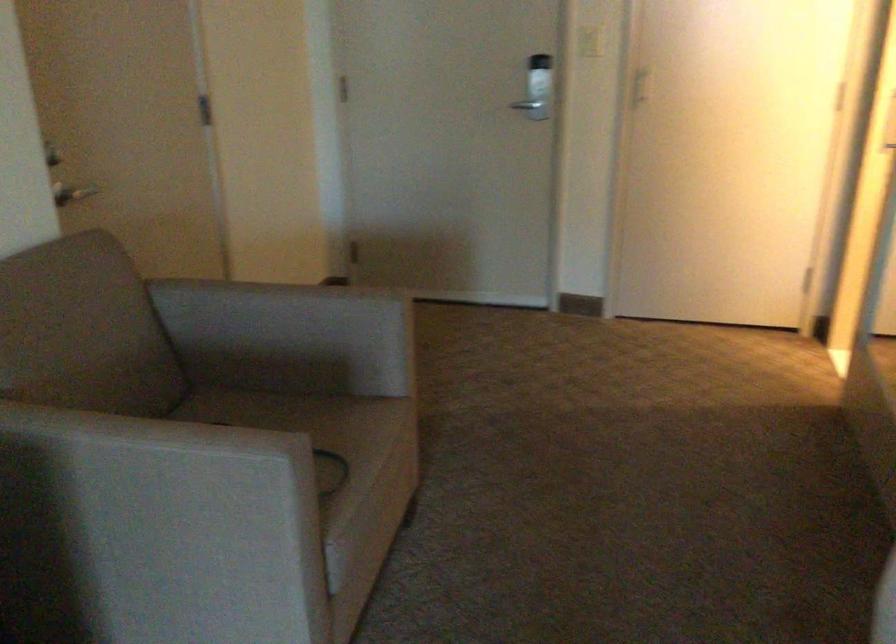
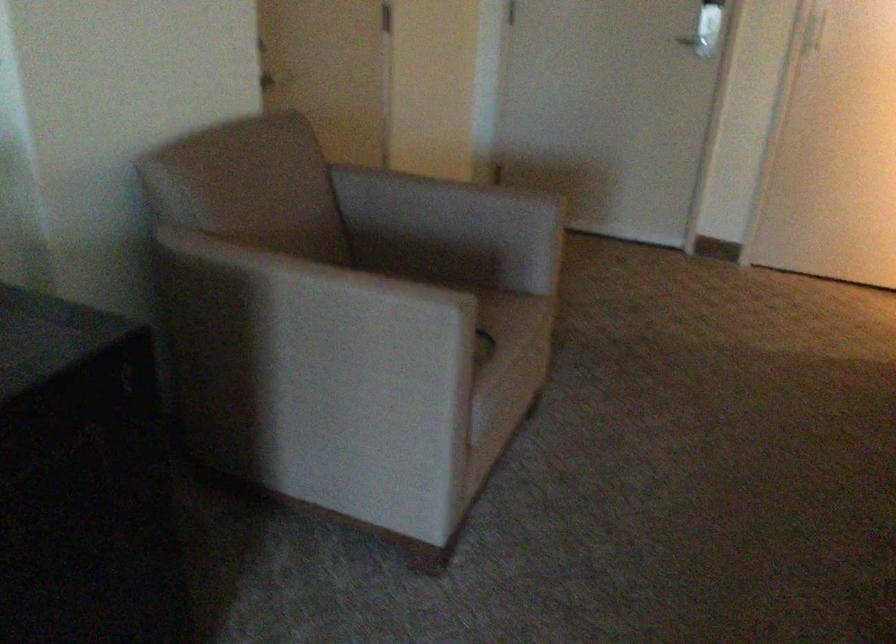
Locate, in the second image, the point that corresponds to [371,467] in the first image.

(513, 345)